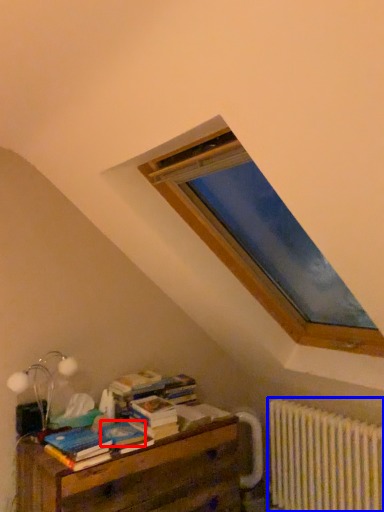
Question: Among these objects, which one is farthest to the camera, paperback book (highlighted by a red box) or radiator (highlighted by a blue box)?

Choices:
 (A) paperback book
 (B) radiator

Answer: (B)